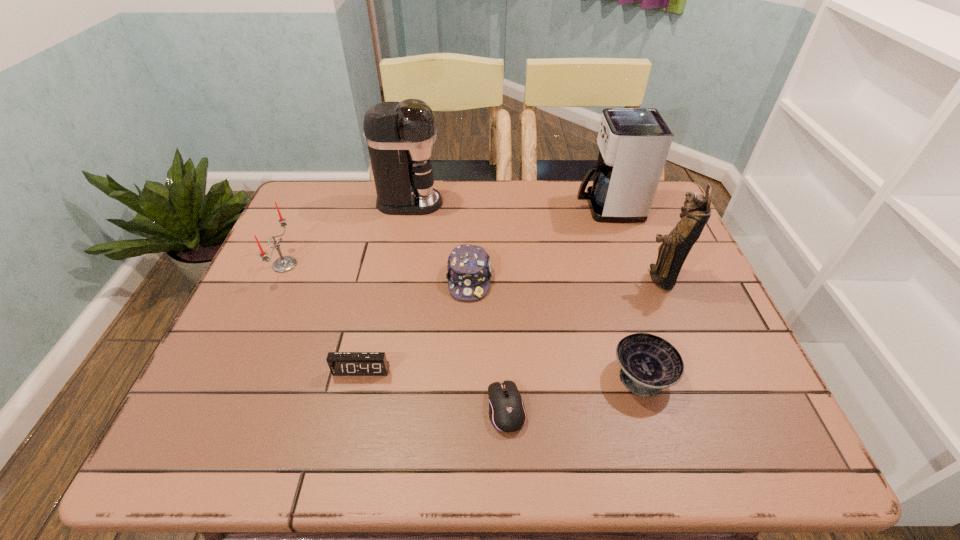
This screenshot has height=540, width=960. What are the coordinates of `free space at the far left corner of the desktop` in the screenshot? It's located at (320, 194).

Locate an element on the screen. This screenshot has height=540, width=960. free space at the near left corner of the desktop is located at coordinates (245, 424).

Identify the location of free space at the near right corner. (756, 449).

I want to click on free space between the bowl and the computer mouse, so click(x=574, y=392).

Where is `unoccupied position between the bowl and the computer mouse`? unoccupied position between the bowl and the computer mouse is located at coordinates (574, 392).

The width and height of the screenshot is (960, 540). What are the coordinates of `vacant point located between the headwear and the bowl` in the screenshot? It's located at tap(556, 327).

Locate an element on the screen. free space between the right coffee maker and the shortest object is located at coordinates (557, 308).

Where is `vacant space that's between the left coffee maker and the right coffee maker`? The width and height of the screenshot is (960, 540). vacant space that's between the left coffee maker and the right coffee maker is located at coordinates (509, 205).

What are the coordinates of `free space that is in between the leftmost object and the shortest object` in the screenshot? It's located at (396, 337).

Where is `vacant region between the alarm clock and the figurine`? vacant region between the alarm clock and the figurine is located at coordinates (511, 324).